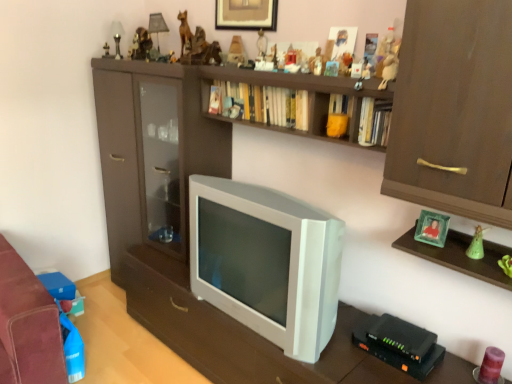
Locate an element on the screen. matte plastic pyramid at upper center, which ranks as the eighth toy in front-to-back order is located at coordinates (236, 51).

This screenshot has height=384, width=512. Describe the element at coordinates (316, 63) in the screenshot. I see `matte brown figurine at upper center, positioned as the 5th toy in front-to-back order` at that location.

This screenshot has width=512, height=384. In order to click on green glass photo frame at upper right in this screenshot , I will do `click(432, 228)`.

Locate an element on the screen. white plastic television at center is located at coordinates (266, 262).

This screenshot has height=384, width=512. Describe the element at coordinates (266, 262) in the screenshot. I see `white plastic television at center` at that location.

The width and height of the screenshot is (512, 384). Find the location of `green matte figurine at right, which ranks as the second toy in bottom-to-top order`. green matte figurine at right, which ranks as the second toy in bottom-to-top order is located at coordinates (476, 244).

At what (x,y) coordinates should I click in order to perform the action: click on metallic gold statue at upper center, which appears as the first toy when viewed from the back. Please return your answer as a coordinate pair (x, y). The height and width of the screenshot is (384, 512). Looking at the image, I should click on (106, 51).

Can you tell me how much hardcover book at upper center, arranged as the 3th book when viewed from the right, and yellow matte bookshelf at upper center, the 2th book from the left, differ in facing direction?

The facing directions of hardcover book at upper center, arranged as the 3th book when viewed from the right, and yellow matte bookshelf at upper center, the 2th book from the left, are 0.954 degrees apart.

Who is taller, hardcover book at upper center, which is counted as the 1th book, starting from the left, or yellow matte bookshelf at upper center, marked as the second book in a right-to-left arrangement?

Standing taller between the two is hardcover book at upper center, which is counted as the 1th book, starting from the left.

From the image's perspective, is hardcover book at upper center, placed as the 1th book when sorted from back to front, above yellow matte bookshelf at upper center, marked as the second book in a front-to-back arrangement?

Yes, from the image's perspective, hardcover book at upper center, placed as the 1th book when sorted from back to front, is above yellow matte bookshelf at upper center, marked as the second book in a front-to-back arrangement.

Based on the photo, from a real-world perspective, does hardcover book at upper center, which is counted as the 1th book, starting from the left, sit lower than yellow matte bookshelf at upper center, marked as the second book in a front-to-back arrangement?

No, from a real-world perspective, hardcover book at upper center, which is counted as the 1th book, starting from the left, is not beneath yellow matte bookshelf at upper center, marked as the second book in a front-to-back arrangement.

Which of these two, matte plastic pyramid at upper center, which ranks as the eighth toy in front-to-back order, or matte brown figurine at upper center, the fifth toy positioned from the bottom, stands taller?

matte plastic pyramid at upper center, which ranks as the eighth toy in front-to-back order, is taller.

Are matte plastic pyramid at upper center, positioned as the 8th toy in bottom-to-top order, and matte brown figurine at upper center, placed as the seventh toy when sorted from left to right, far apart?

No, there isn't a large distance between matte plastic pyramid at upper center, positioned as the 8th toy in bottom-to-top order, and matte brown figurine at upper center, placed as the seventh toy when sorted from left to right.

Is matte plastic pyramid at upper center, which ranks as the eighth toy in front-to-back order, inside the boundaries of matte brown figurine at upper center, the fifth toy positioned from the bottom, or outside?

matte plastic pyramid at upper center, which ranks as the eighth toy in front-to-back order, is not enclosed by matte brown figurine at upper center, the fifth toy positioned from the bottom.

From a real-world perspective, is matte plastic pyramid at upper center, positioned as the 8th toy in bottom-to-top order, located higher than matte brown figurine at upper center, arranged as the fifth toy when viewed from the right?

Indeed, from a real-world perspective, matte plastic pyramid at upper center, positioned as the 8th toy in bottom-to-top order, stands above matte brown figurine at upper center, arranged as the fifth toy when viewed from the right.

Could you tell me if matte plastic pyramid at upper center, the 5th toy when ordered from left to right, is turned towards matte wooden figurine at upper center, the 3th toy from the back?

No, matte plastic pyramid at upper center, the 5th toy when ordered from left to right, is not turned towards matte wooden figurine at upper center, the 3th toy from the back.

Is matte plastic pyramid at upper center, the fourth toy in the top-to-bottom sequence, shorter than matte wooden figurine at upper center, which is counted as the 2th toy, starting from the left?

Incorrect, the height of matte plastic pyramid at upper center, the fourth toy in the top-to-bottom sequence, does not fall short of that of matte wooden figurine at upper center, which is counted as the 2th toy, starting from the left.

Does matte plastic pyramid at upper center, which ranks as the eighth toy in front-to-back order, come behind matte wooden figurine at upper center, the 3th toy from the back?

No, it is in front of matte wooden figurine at upper center, the 3th toy from the back.

Could you measure the distance between matte plastic pyramid at upper center, which ranks as the eighth toy in front-to-back order, and matte wooden figurine at upper center, arranged as the tenth toy when viewed from the right?

matte plastic pyramid at upper center, which ranks as the eighth toy in front-to-back order, and matte wooden figurine at upper center, arranged as the tenth toy when viewed from the right, are 12.37 inches apart.

From the image's perspective, which object appears higher, matte brown figurine at upper center, which ranks as the 7th toy in top-to-bottom order, or green matte figurine at right, marked as the tenth toy in a back-to-front arrangement?

Answer: matte brown figurine at upper center, which ranks as the 7th toy in top-to-bottom order, appears higher in the image.

What's the angular difference between matte brown figurine at upper center, placed as the seventh toy when sorted from left to right, and green matte figurine at right, which ranks as the second toy in bottom-to-top order,'s facing directions?

The angle between the facing direction of matte brown figurine at upper center, placed as the seventh toy when sorted from left to right, and the facing direction of green matte figurine at right, which ranks as the second toy in bottom-to-top order, is 2.45 degrees.

Consider the image. Is the depth of matte brown figurine at upper center, arranged as the seventh toy when viewed from the back, less than that of green matte figurine at right, the tenth toy when ordered from left to right?

No, it is not.

From a real-world perspective, is matte brown figurine at upper center, arranged as the seventh toy when viewed from the back, on green matte figurine at right, which ranks as the second toy in bottom-to-top order?

Yes.

I want to click on toy that is the 3rd one when counting backward from the hardcover books at upper center, placed as the 3th book when sorted from left to right, so click(347, 59).

Considering the sizes of objects hardcover books at upper center, acting as the 1th book starting from the front, and matte plastic toy at upper center, the fourth toy from the right, in the image provided, who is thinner, hardcover books at upper center, acting as the 1th book starting from the front, or matte plastic toy at upper center, the fourth toy from the right,?

matte plastic toy at upper center, the fourth toy from the right.

Between hardcover books at upper center, acting as the 1th book starting from the front, and matte plastic toy at upper center, which is the 8th toy from left to right, which one has larger size?

Bigger between the two is hardcover books at upper center, acting as the 1th book starting from the front.

Can you confirm if hardcover books at upper center, placed as the 3th book when sorted from left to right, is taller than matte plastic toy at upper center, which is the 8th toy from left to right?

Correct, hardcover books at upper center, placed as the 3th book when sorted from left to right, is much taller as matte plastic toy at upper center, which is the 8th toy from left to right.

In the image, is matte brown shelf at center positioned in front of or behind matte brown figurine at upper center, the fifth toy positioned from the bottom?

In the image, matte brown shelf at center appears in front of matte brown figurine at upper center, the fifth toy positioned from the bottom.

Could you tell me if matte brown shelf at center is turned towards matte brown figurine at upper center, positioned as the 5th toy in front-to-back order?

Yes, matte brown shelf at center is facing matte brown figurine at upper center, positioned as the 5th toy in front-to-back order.

Considering the relative sizes of matte brown shelf at center and matte brown figurine at upper center, arranged as the fifth toy when viewed from the right, in the image provided, is matte brown shelf at center shorter than matte brown figurine at upper center, arranged as the fifth toy when viewed from the right,?

In fact, matte brown shelf at center may be taller than matte brown figurine at upper center, arranged as the fifth toy when viewed from the right.

Does matte brown shelf at center appear on the right side of matte brown figurine at upper center, positioned as the 5th toy in front-to-back order?

Incorrect, matte brown shelf at center is not on the right side of matte brown figurine at upper center, positioned as the 5th toy in front-to-back order.

From the hardcover book at upper center, placed as the 1th book when sorted from back to front, count the 3rd toy to the left and point to it. Please provide its 2D coordinates.

[(197, 49)]

Would you say hardcover book at upper center, arranged as the third book when viewed from the front, is part of wooden statue at upper center, which appears as the seventh toy when viewed from the front,'s contents?

Actually, hardcover book at upper center, arranged as the third book when viewed from the front, is outside wooden statue at upper center, which appears as the seventh toy when viewed from the front.

From the image's perspective, which is above, wooden statue at upper center, which appears as the seventh toy when viewed from the front, or hardcover book at upper center, arranged as the third book when viewed from the front?

wooden statue at upper center, which appears as the seventh toy when viewed from the front, is shown above in the image.

Would you say wooden statue at upper center, positioned as the ninth toy in bottom-to-top order, is to the left or to the right of hardcover book at upper center, placed as the 1th book when sorted from back to front, in the picture?

wooden statue at upper center, positioned as the ninth toy in bottom-to-top order, is positioned on hardcover book at upper center, placed as the 1th book when sorted from back to front,'s left side.

Locate an element on the screen. the 1st book below when counting from the hardcover book at upper center, placed as the 1th book when sorted from back to front (from the image's perspective) is located at coordinates (338, 115).

In order to click on toy that is the 3rd object located above the matte brown figurine at upper center, positioned as the 5th toy in front-to-back order (from the image's perspective) in this screenshot , I will do `click(236, 51)`.

From the picture: Which object lies further to the anchor point wooden statue at upper center, which appears as the seventh toy when viewed from the front, matte plastic toy at upper center, marked as the 4th toy in a front-to-back arrangement, or green matte figurine at right, marked as the tenth toy in a back-to-front arrangement?

green matte figurine at right, marked as the tenth toy in a back-to-front arrangement, is positioned further to the anchor wooden statue at upper center, which appears as the seventh toy when viewed from the front.

Which object lies nearer to the anchor point green matte figurine at right, which ranks as the second toy in bottom-to-top order, matte plastic figurine at upper center, positioned as the 6th toy in right-to-left order, or green glass photo frame at upper right?

green glass photo frame at upper right lies closer to green matte figurine at right, which ranks as the second toy in bottom-to-top order, than the other object.

When comparing their distances from hardcover books at upper center, acting as the 1th book starting from the front, does white plastic television at center or metallic gold statue at upper center, marked as the eleventh toy in a front-to-back arrangement, seem further?

metallic gold statue at upper center, marked as the eleventh toy in a front-to-back arrangement.

Consider the image. Estimate the real-world distances between objects in this image. Which object is closer to green matte figurine at right, which appears as the second toy when viewed from the front, yellow matte bookshelf at upper center, the 2th book from the left, or metallic gold statue at upper center, which ranks as the 2th toy in top-to-bottom order?

Based on the image, yellow matte bookshelf at upper center, the 2th book from the left, appears to be nearer to green matte figurine at right, which appears as the second toy when viewed from the front.

Based on their spatial positions, is matte plastic figurine at upper center, positioned as the sixth toy in bottom-to-top order, or yellow matte bookshelf at upper center, marked as the second book in a front-to-back arrangement, closer to hardcover book at upper center, placed as the 1th book when sorted from back to front?

yellow matte bookshelf at upper center, marked as the second book in a front-to-back arrangement, is closer to hardcover book at upper center, placed as the 1th book when sorted from back to front.

Looking at the image, which one is located further to translucent purple candle at lower right, the 1th toy from the right, matte plastic pyramid at upper center, which ranks as the eighth toy in front-to-back order, or matte brown shelf at center?

matte plastic pyramid at upper center, which ranks as the eighth toy in front-to-back order, is positioned further to the anchor translucent purple candle at lower right, the 1th toy from the right.

Which object lies nearer to the anchor point green matte figurine at right, which appears as the 2th toy when viewed from the right, hardcover book at upper center, arranged as the 3th book when viewed from the right, or wooden statue at upper center, the fifth toy positioned from the back?

hardcover book at upper center, arranged as the 3th book when viewed from the right, lies closer to green matte figurine at right, which appears as the 2th toy when viewed from the right, than the other object.

Estimate the real-world distances between objects in this image. Which object is further from matte brown statue at upper center, the third toy when ordered from left to right, matte brown figurine at upper center, arranged as the fifth toy when viewed from the right, or matte plastic pyramid at upper center, the fourth toy in the top-to-bottom sequence?

matte brown figurine at upper center, arranged as the fifth toy when viewed from the right, is positioned further to the anchor matte brown statue at upper center, the third toy when ordered from left to right.

The width and height of the screenshot is (512, 384). In order to click on picture frame between hardcover book at upper center, placed as the 1th book when sorted from back to front, and white plastic television at center vertically in this screenshot , I will do `click(432, 228)`.

I want to click on toy between hardcover book at upper center, which is counted as the 1th book, starting from the left, and matte plastic toy at upper center, which is the fourth toy from bottom to top, from left to right, so click(316, 63).

This screenshot has width=512, height=384. Identify the location of shelf between hardcover book at upper center, arranged as the 3th book when viewed from the right, and green matte figurine at right, the tenth toy in the top-to-bottom sequence, from left to right. (182, 231).

The image size is (512, 384). In order to click on shelf between matte wooden figurine at upper center, placed as the ninth toy when sorted from front to back, and green matte figurine at right, the tenth toy in the top-to-bottom sequence in this screenshot , I will do `click(182, 231)`.